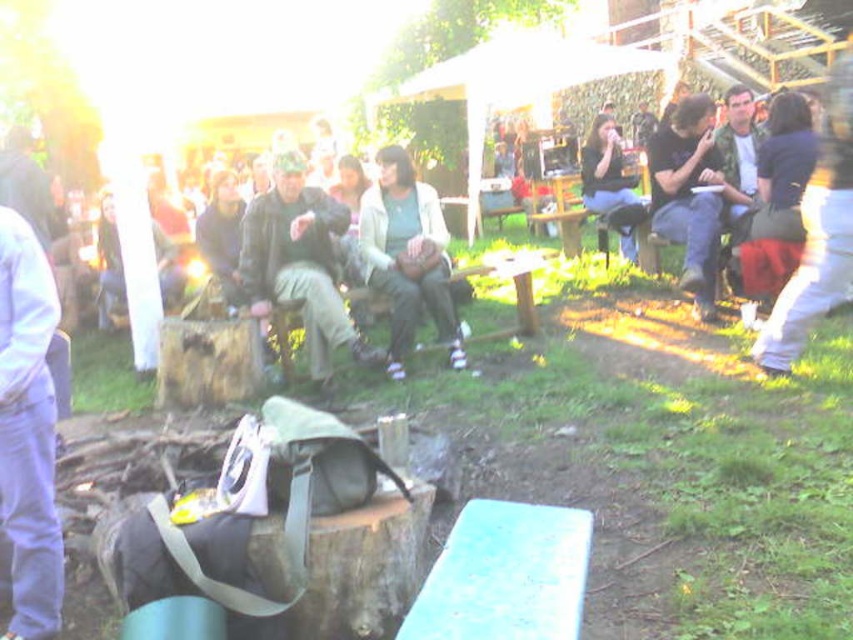
Question: Among these objects, which one is nearest to the camera?

Choices:
 (A) camouflage jacket at center
 (B) light beige sweater at center

Answer: (A)

Question: Does camouflage jacket at center lie in front of light beige sweater at center?

Choices:
 (A) no
 (B) yes

Answer: (B)

Question: Among these objects, which one is nearest to the camera?

Choices:
 (A) camouflage jacket at center
 (B) light beige sweater at center

Answer: (A)

Question: Among these objects, which one is farthest from the camera?

Choices:
 (A) light beige sweater at center
 (B) camouflage jacket at center

Answer: (A)

Question: Is camouflage jacket at center thinner than light beige sweater at center?

Choices:
 (A) yes
 (B) no

Answer: (B)

Question: Is camouflage jacket at center bigger than light beige sweater at center?

Choices:
 (A) no
 (B) yes

Answer: (B)